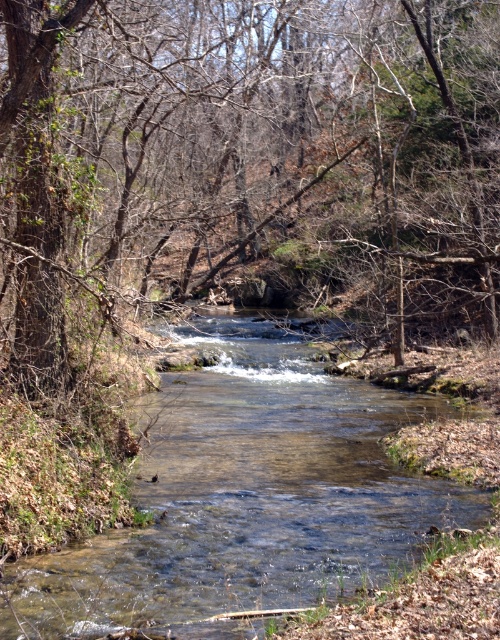
Is point (243, 81) closer to camera compared to point (242, 586)?

No, it is behind (242, 586).

Between brown wood tree at center and clear water at center, which one is positioned higher?

brown wood tree at center

I want to click on brown wood tree at center, so click(x=248, y=156).